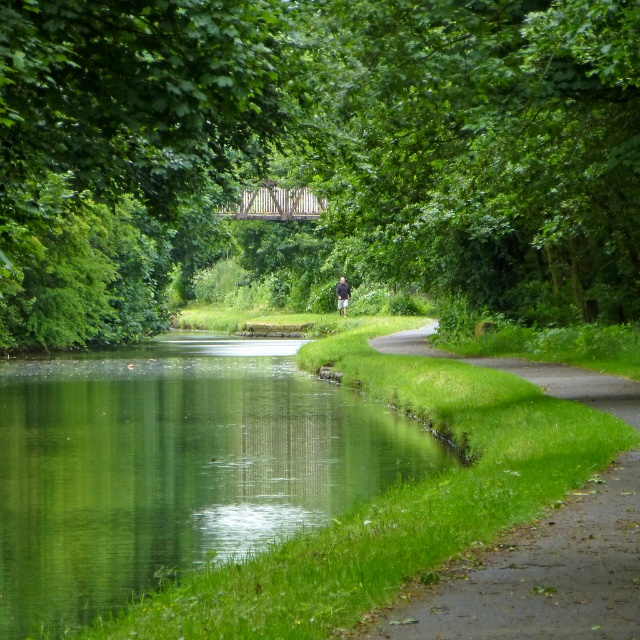
Is green leafy tree at center taller than dark gray jacket at center?

Yes, green leafy tree at center is taller than dark gray jacket at center.

Can you confirm if green leafy tree at center is smaller than dark gray jacket at center?

No, green leafy tree at center is not smaller than dark gray jacket at center.

Locate an element on the screen. The image size is (640, 640). green leafy tree at center is located at coordinates (314, 157).

Between green grassy river at lower left and green grassy path at lower right, which one is positioned higher?

Positioned higher is green grassy path at lower right.

What do you see at coordinates (173, 467) in the screenshot?
I see `green grassy river at lower left` at bounding box center [173, 467].

You are a GUI agent. You are given a task and a screenshot of the screen. Output one action in this format:
    pyautogui.click(x=<x>, y=<y>)
    Task: Click on the green grassy river at lower left
    This screenshot has width=640, height=640.
    Given the screenshot: What is the action you would take?
    pyautogui.click(x=173, y=467)

Is point (116, 436) behind point (346, 285)?

That is False.

Who is higher up, green grassy river at lower left or dark gray jacket at center?

dark gray jacket at center

The image size is (640, 640). Find the location of `green grassy river at lower left`. green grassy river at lower left is located at coordinates [173, 467].

You are a GUI agent. You are given a task and a screenshot of the screen. Output one action in this format:
    pyautogui.click(x=<x>, y=<y>)
    Task: Click on the green grassy river at lower left
    This screenshot has width=640, height=640.
    Given the screenshot: What is the action you would take?
    pyautogui.click(x=173, y=467)